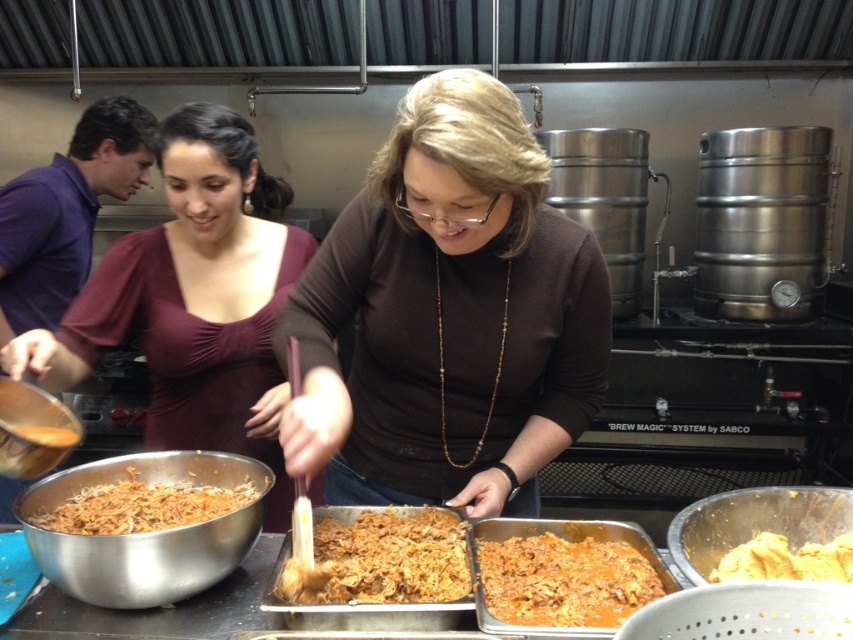
Is point (409, 305) positioned in front of point (144, 253)?

Yes, point (409, 305) is closer to viewer.

Image resolution: width=853 pixels, height=640 pixels. What are the coordinates of `brown matte shirt at center` in the screenshot? It's located at (448, 316).

Where is `brown matte shirt at center`? brown matte shirt at center is located at coordinates (448, 316).

Does matte burgundy blouse at center have a lesser width compared to brown crumbly food at center?

No.

Who is positioned more to the right, matte burgundy blouse at center or brown crumbly food at center?

brown crumbly food at center is more to the right.

Does point (184, 248) lie in front of point (347, 552)?

No, it is behind (347, 552).

Identify the location of matte burgundy blouse at center. (193, 300).

From the picture: Which is more to the right, shiny silver bowl at lower left or brown shredded food at lower left?

Positioned to the right is shiny silver bowl at lower left.

Who is more distant from viewer, (245, 541) or (171, 500)?

Positioned behind is point (171, 500).

Where is `shiny silver bowl at lower left`? The image size is (853, 640). shiny silver bowl at lower left is located at coordinates (144, 532).